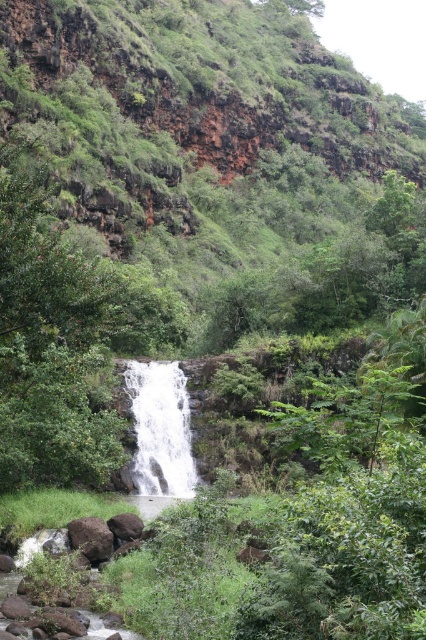
You are a GUI agent. You are given a task and a screenshot of the screen. Output one action in this format:
    pyautogui.click(x=<x>, y=<y>)
    Task: Click on the green mossy hillside at upper center
    This screenshot has height=640, width=426.
    Given the screenshot: What is the action you would take?
    pyautogui.click(x=198, y=125)

Which is in front, point (98, 100) or point (173, 429)?

Point (173, 429) is more forward.

This screenshot has height=640, width=426. I want to click on green mossy hillside at upper center, so click(198, 125).

Is green mossy hillside at upper center bigger than brown rough rock at lower center?

Correct, green mossy hillside at upper center is larger in size than brown rough rock at lower center.

Is green mossy hillside at upper center shorter than brown rough rock at lower center?

No, green mossy hillside at upper center is not shorter than brown rough rock at lower center.

You are a GUI agent. You are given a task and a screenshot of the screen. Output one action in this format:
    pyautogui.click(x=<x>, y=<y>)
    Task: Click on the green mossy hillside at upper center
    
    Given the screenshot: What is the action you would take?
    pyautogui.click(x=198, y=125)

The image size is (426, 640). Identify the location of green mossy hillside at upper center. (198, 125).

Between white frothy water at center and smooth brown rock at lower left, which one has more height?

Standing taller between the two is white frothy water at center.

Does white frothy water at center have a lesser height compared to smooth brown rock at lower left?

Incorrect, white frothy water at center's height does not fall short of smooth brown rock at lower left's.

Which is in front, point (147, 476) or point (85, 529)?

Point (85, 529) is more forward.

The width and height of the screenshot is (426, 640). In order to click on white frothy water at center in this screenshot , I will do `click(161, 429)`.